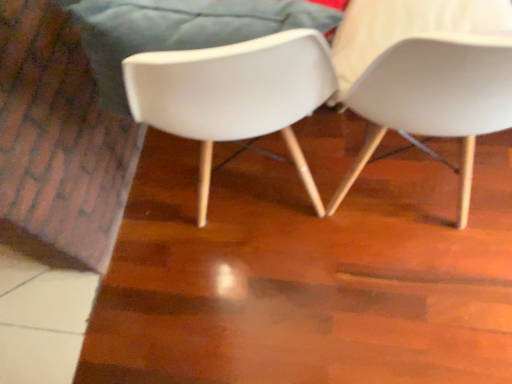
This screenshot has width=512, height=384. What are the coordinates of `vacant space positioned to the left of white matte chair at center, the 1th chair from the left` in the screenshot? It's located at (161, 228).